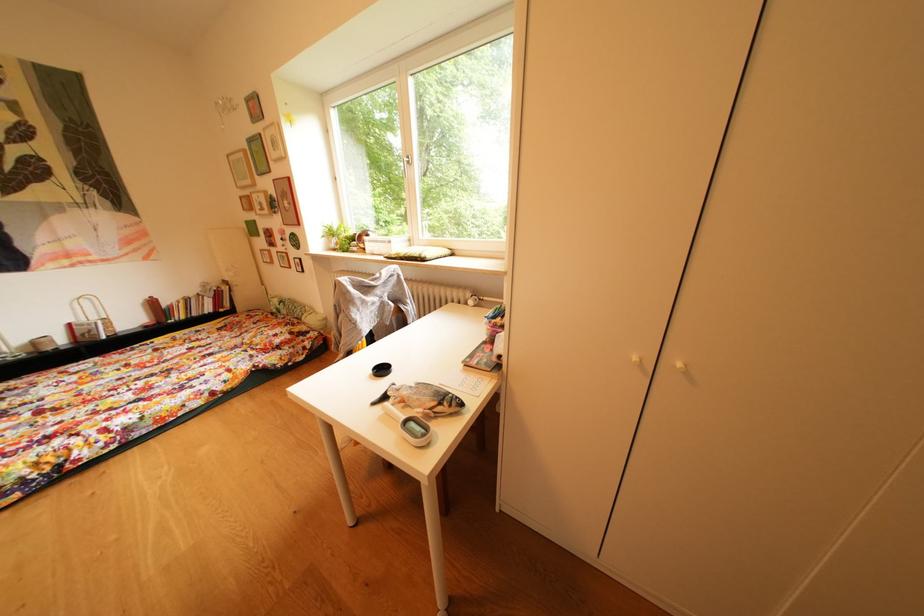
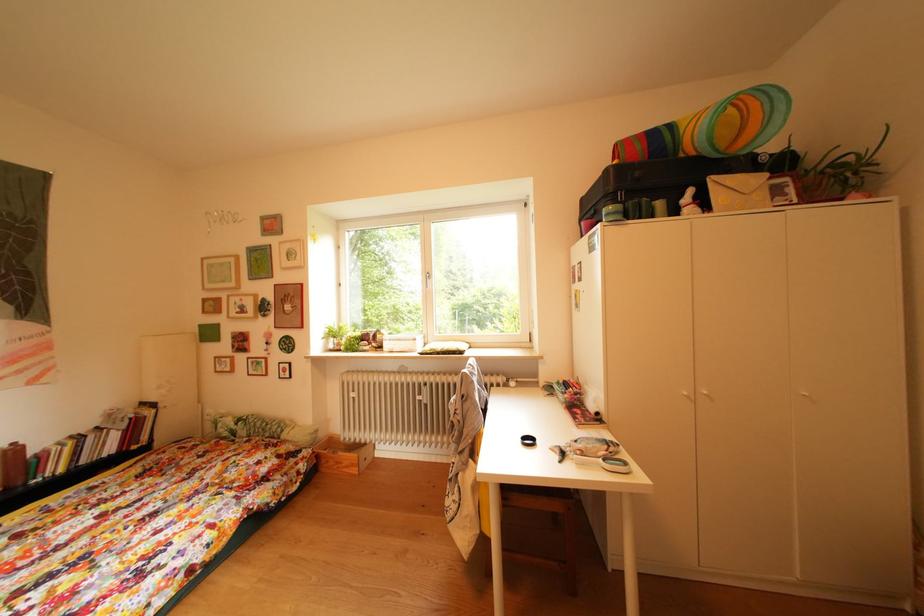
Question: What movement of the cameraman would produce the second image?

Choices:
 (A) Left
 (B) Right
 (C) Forward
 (D) Backward

Answer: (A)